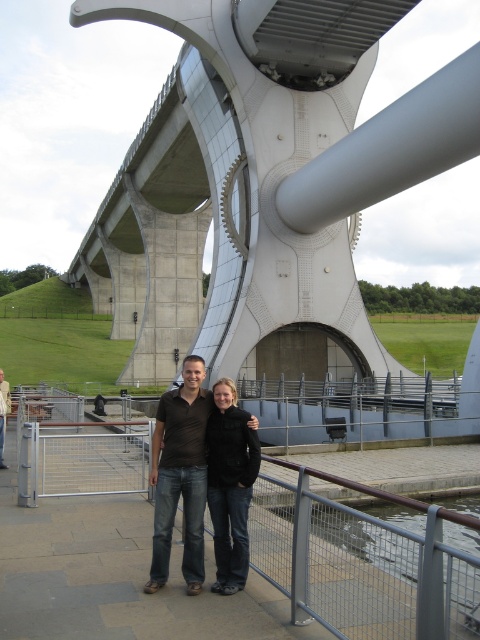
You are a photographer who wants to capture the brown cotton shirt at center in a closeup shot. According to the coordinates provided, where should you aim your camera?

The brown cotton shirt at center is located at coordinates point (180, 474), so aim your camera there to capture it in a closeup shot.

You are a photographer planning to capture a wide shot of the scene. Given that the metallic gray bridge at center and the black leather jacket at center are both in the frame, which object occupies more horizontal space in the image?

The metallic gray bridge at center occupies more horizontal space in the image because its width surpasses that of the black leather jacket at center.